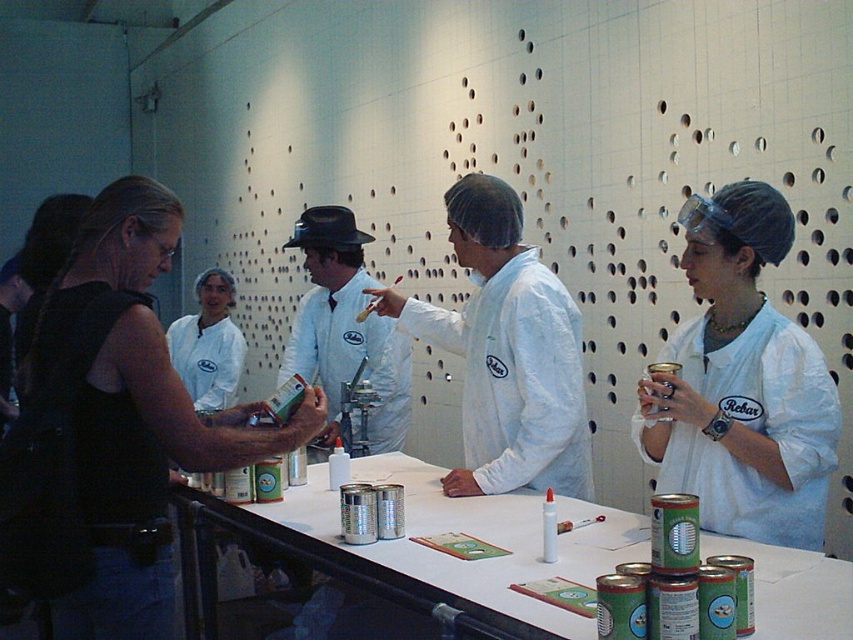
You are an observer in the workshop. You notice the black fabric vest at left and the white fabric shirt at center. Which one is positioned lower on the table?

The black fabric vest at left is positioned lower on the table since it is below the white fabric shirt at center.

You are a participant in the workshop and need to pass a tool from the black fabric vest at left to the white fabric shirt at center. Can you do it without leaving your current position?

The distance between the black fabric vest at left and the white fabric shirt at center is 1.90 meters, so you cannot pass the tool without moving since the distance is too far to reach.